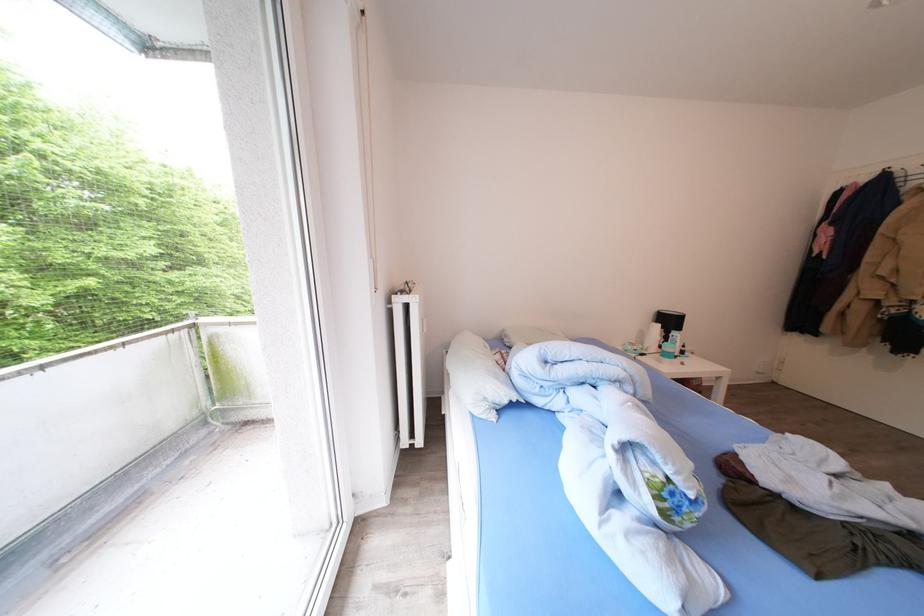
The image size is (924, 616). Describe the element at coordinates (424, 323) in the screenshot. I see `a radiator control knob` at that location.